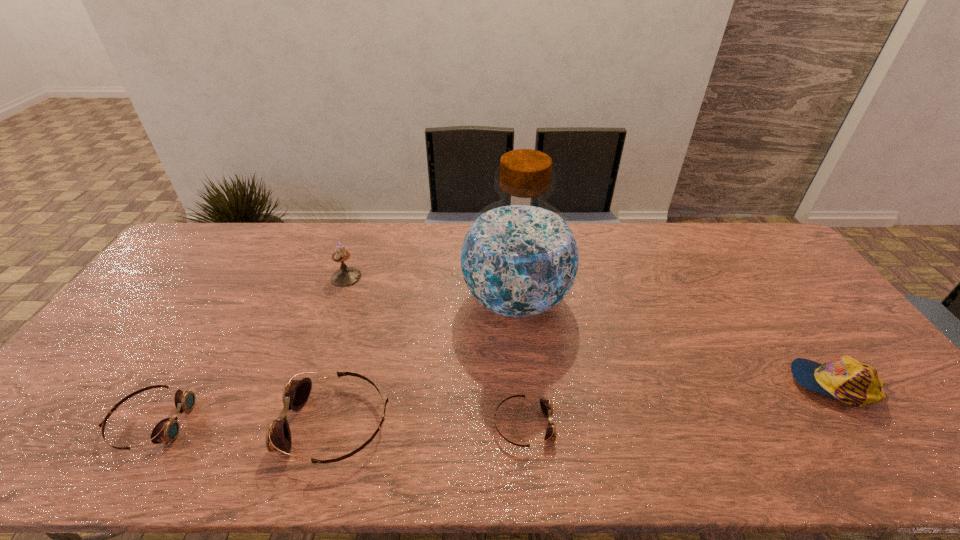
At what (x,y) coordinates should I click in order to perform the action: click on the leftmost goggles. Please return your answer as a coordinate pair (x, y). The width and height of the screenshot is (960, 540). Looking at the image, I should click on (167, 430).

This screenshot has height=540, width=960. I want to click on the fifth tallest object, so click(x=167, y=430).

Locate an element on the screen. This screenshot has width=960, height=540. the second goggles from right to left is located at coordinates [296, 392].

Locate an element on the screen. the shortest goggles is located at coordinates (546, 406).

Where is `the shortest object`? This screenshot has height=540, width=960. the shortest object is located at coordinates (546, 406).

Identify the location of the fifth shortest object. (346, 276).

Locate an element on the screen. This screenshot has width=960, height=540. the tallest object is located at coordinates (519, 258).

Find the location of a particular element. the rightmost object is located at coordinates (853, 382).

The height and width of the screenshot is (540, 960). What are the coordinates of `vacant region located through the lenses of the leftmost goggles` in the screenshot? It's located at (272, 422).

The width and height of the screenshot is (960, 540). What are the coordinates of `vacant space located through the lenses of the tallest goggles` in the screenshot? It's located at 128,423.